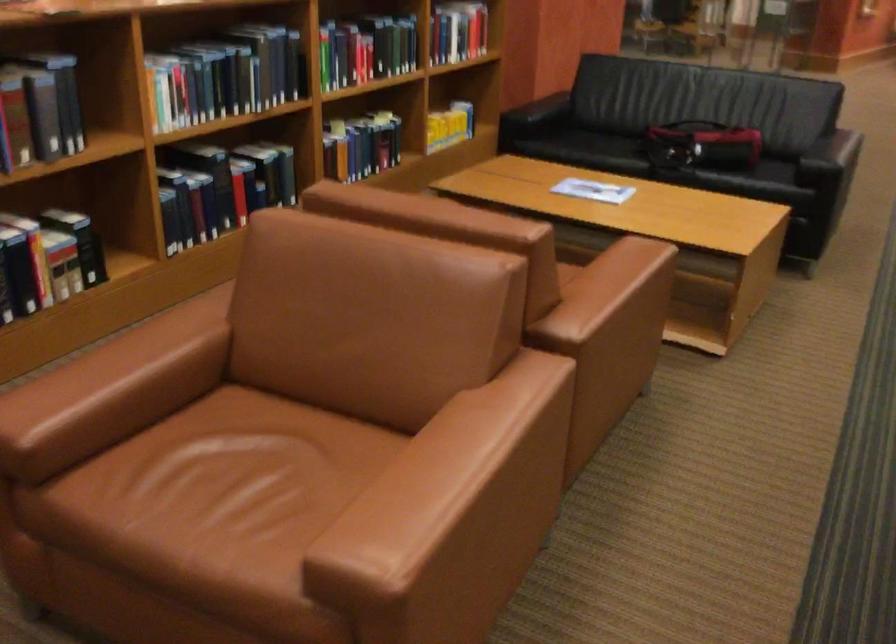
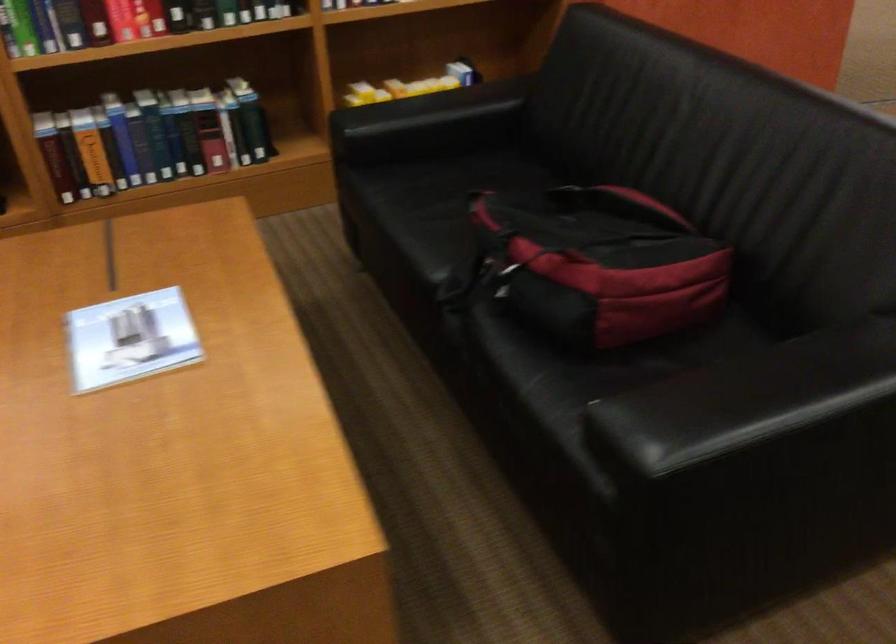
Where in the second image is the point corresponding to the point at 674,156 from the first image?

(495, 277)